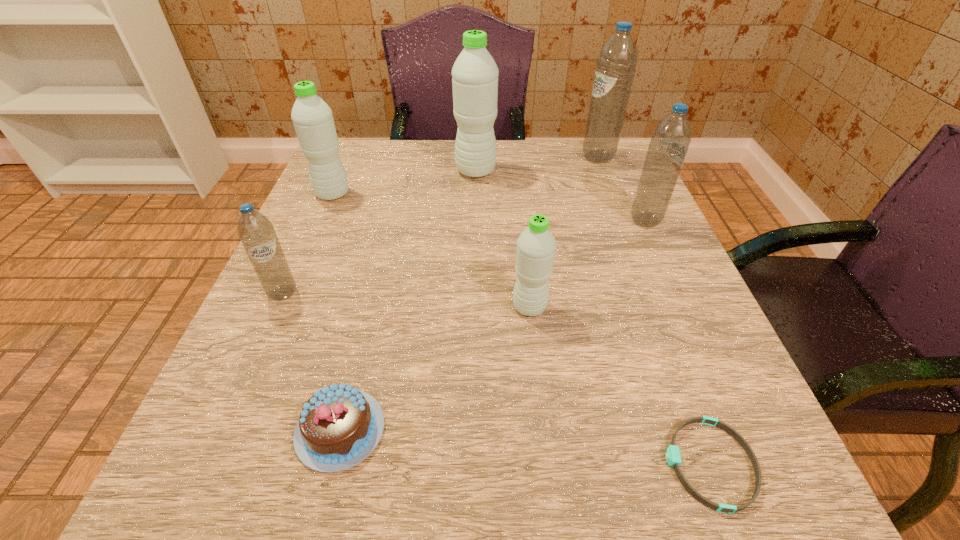
In order to click on the farthest green water bottle in this screenshot , I will do `click(475, 74)`.

Find the location of `the biggest green water bottle`. the biggest green water bottle is located at coordinates (475, 74).

Identify the location of the farthest blue water bottle. (616, 63).

Find the location of `the second farthest green water bottle`. the second farthest green water bottle is located at coordinates (312, 118).

Find the location of a particular element. This screenshot has width=960, height=540. the leftmost green water bottle is located at coordinates (312, 118).

The image size is (960, 540). I want to click on the second farthest blue water bottle, so click(x=669, y=144).

You are a GUI agent. You are given a task and a screenshot of the screen. Output one action in this format:
    pyautogui.click(x=<x>, y=<y>)
    Task: Click on the second biggest blue water bottle
    This screenshot has height=540, width=960.
    Given the screenshot: What is the action you would take?
    pyautogui.click(x=669, y=144)

You are a GUI agent. You are given a task and a screenshot of the screen. Output one action in this format:
    pyautogui.click(x=<x>, y=<y>)
    Task: Click on the nearest green water bottle
    This screenshot has height=540, width=960.
    Given the screenshot: What is the action you would take?
    pyautogui.click(x=536, y=245)

You are a GUI agent. You are given a task and a screenshot of the screen. Output one action in this format:
    pyautogui.click(x=<x>, y=<y>)
    Task: Click on the fourth object from right to left
    This screenshot has height=540, width=960.
    Given the screenshot: What is the action you would take?
    pyautogui.click(x=536, y=245)

The width and height of the screenshot is (960, 540). I want to click on the smallest blue water bottle, so click(x=257, y=234).